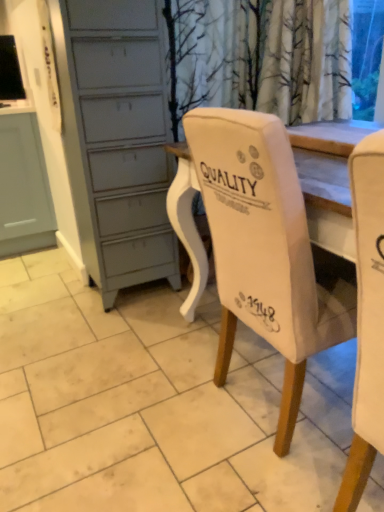
Measure the distance between point (244, 137) and camera.

34.61 inches.

In order to face white fabric chair at center, should I rotate leftwards or rightwards?

You should rotate right by 14.704 degrees.

The image size is (384, 512). What do you see at coordinates (265, 248) in the screenshot?
I see `white fabric chair at center` at bounding box center [265, 248].

Where is `white fabric chair at center`? Image resolution: width=384 pixels, height=512 pixels. white fabric chair at center is located at coordinates (265, 248).

What is the approximate height of white fabric chair at center?

38.25 inches.

You are a GUI agent. You are given a task and a screenshot of the screen. Output one action in this format:
    pyautogui.click(x=<x>, y=<y>)
    Task: Click on the white fabric chair at center
    The width and height of the screenshot is (384, 512).
    Given the screenshot: What is the action you would take?
    pyautogui.click(x=265, y=248)